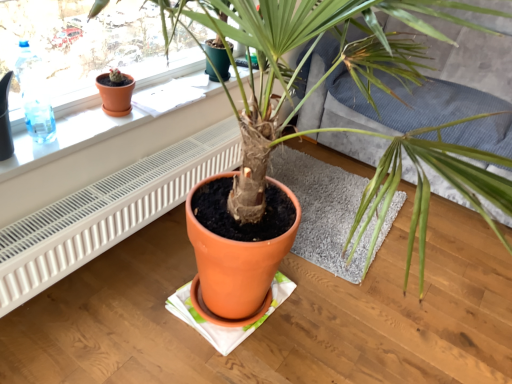
You are a GUI agent. You are given a task and a screenshot of the screen. Output one action in this format:
    pyautogui.click(x=<x>, y=<y>)
    Task: Click on the vacant space to the right of terracotta pot at center
    
    Given the screenshot: What is the action you would take?
    pyautogui.click(x=455, y=272)